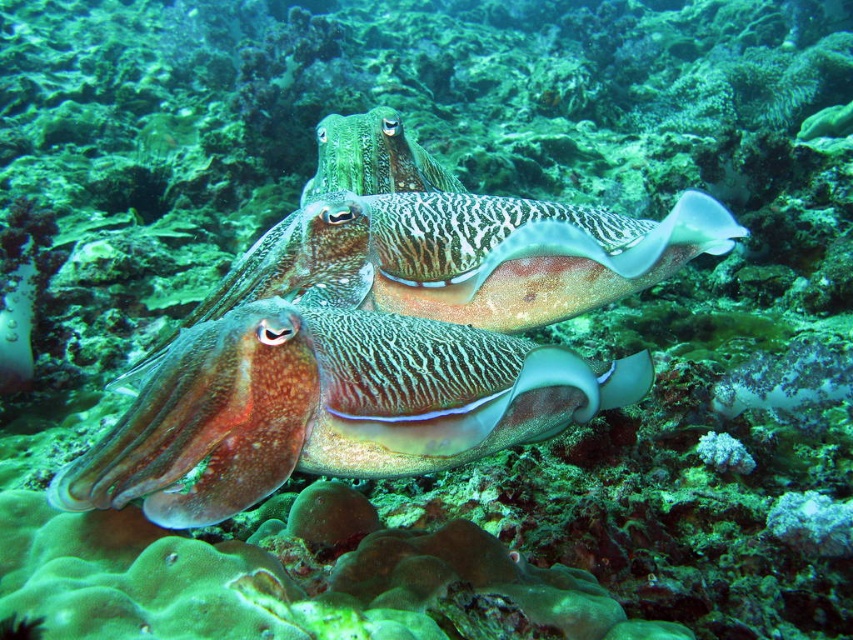
Question: Considering the relative positions of smooth brown squid at center and green textured squid at center in the image provided, where is smooth brown squid at center located with respect to green textured squid at center?

Choices:
 (A) right
 (B) left

Answer: (B)

Question: Which object appears closest to the camera in this image?

Choices:
 (A) green textured squid at center
 (B) smooth brown squid at center

Answer: (B)

Question: Does smooth brown squid at center appear on the right side of green textured squid at center?

Choices:
 (A) yes
 (B) no

Answer: (B)

Question: Is smooth brown squid at center to the right of green textured squid at center from the viewer's perspective?

Choices:
 (A) no
 (B) yes

Answer: (A)

Question: Which point is closer to the camera taking this photo?

Choices:
 (A) (335, 301)
 (B) (410, 353)

Answer: (B)